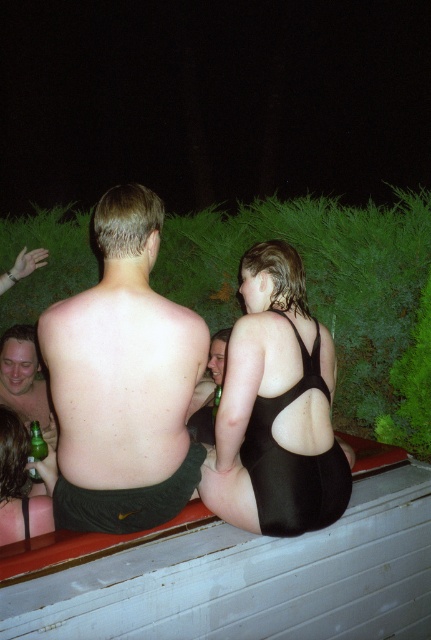
You are standing in front of the pool and want to reach both points. Which point, point (x=0, y=506) or point (x=31, y=451), is closer to you?

Point (x=0, y=506) is closer to the viewer than point (x=31, y=451).

You are a photographer trying to capture a closeup shot of the black matte swimsuit at center and the green glass bottle at lower left. The camera you are using has a maximum focus range of 10 inches. Can you fit both objects within the camera focus range?

The black matte swimsuit at center and the green glass bottle at lower left are 9.44 inches apart, so yes, both objects can be captured within the camera focus range of 10 inches.